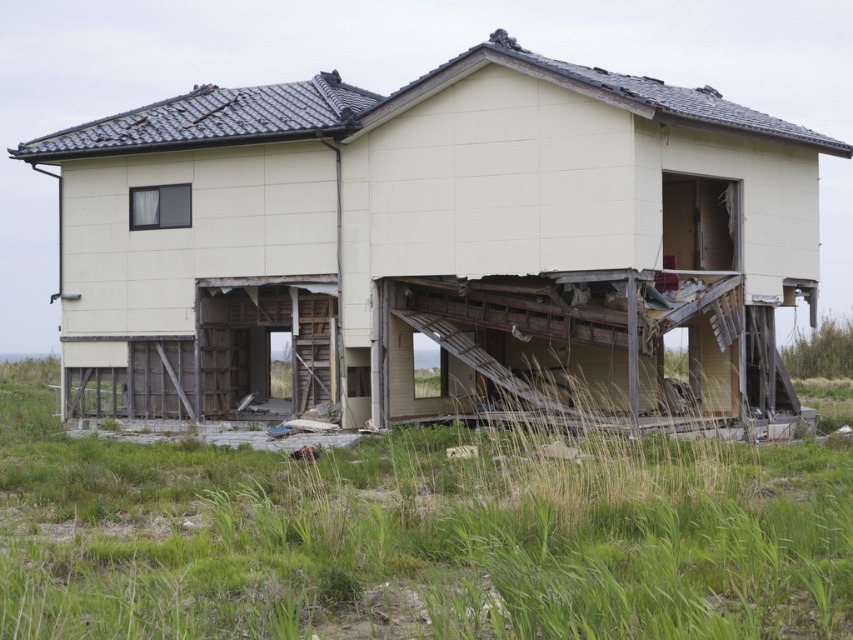
From the picture: Which of these two, beige wood house at center or green grass at lower center, stands shorter?

green grass at lower center

Can you confirm if beige wood house at center is positioned below green grass at lower center?

Actually, beige wood house at center is above green grass at lower center.

Who is more distant from viewer, (444, 289) or (820, 497)?

The point (444, 289) is more distant.

This screenshot has width=853, height=640. Find the location of `beige wood house at center`. beige wood house at center is located at coordinates (431, 243).